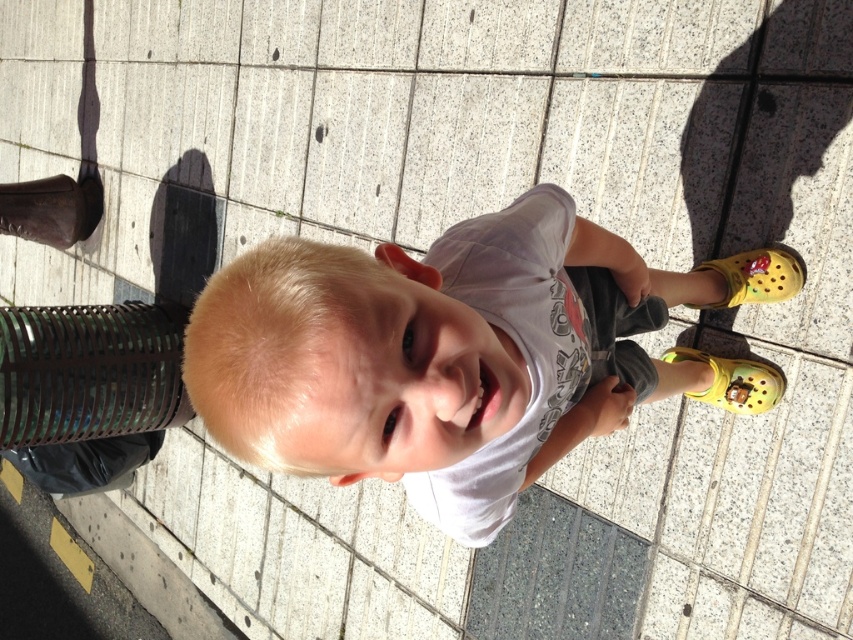
You are a photographer trying to capture a candid shot of the child. You need to ensure that both the white cotton shirt at center and the brown leather boot at left are in focus. Given that your camera can only focus on objects within a 3.5 meter range, will you be able to achieve this?

The white cotton shirt at center and the brown leather boot at left are 4.53 meters apart. Since the camera can only focus on objects within a 3.5 meter range, the distance between them exceeds the focus range. Therefore, it will be difficult to keep both in focus simultaneously.

You are taking a photo of the child standing on the paved surface. The camera is positioned at your eye level. You want to ensure both the point at (531, 275) and the point at (80, 220) are in focus. Which point should you focus on to make sure both are sharp?

You should focus on point (531, 275) because it is closer to the camera than point (80, 220). By focusing on the closer point, the farther point will also be within the depth of field and appear sharp.